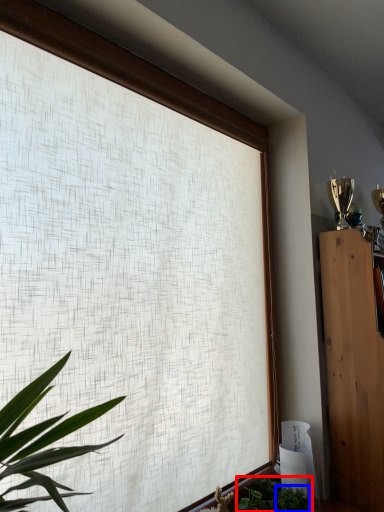
Question: Among these objects, which one is nearest to the camera, houseplant (highlighted by a red box) or plant (highlighted by a blue box)?

Choices:
 (A) houseplant
 (B) plant

Answer: (B)